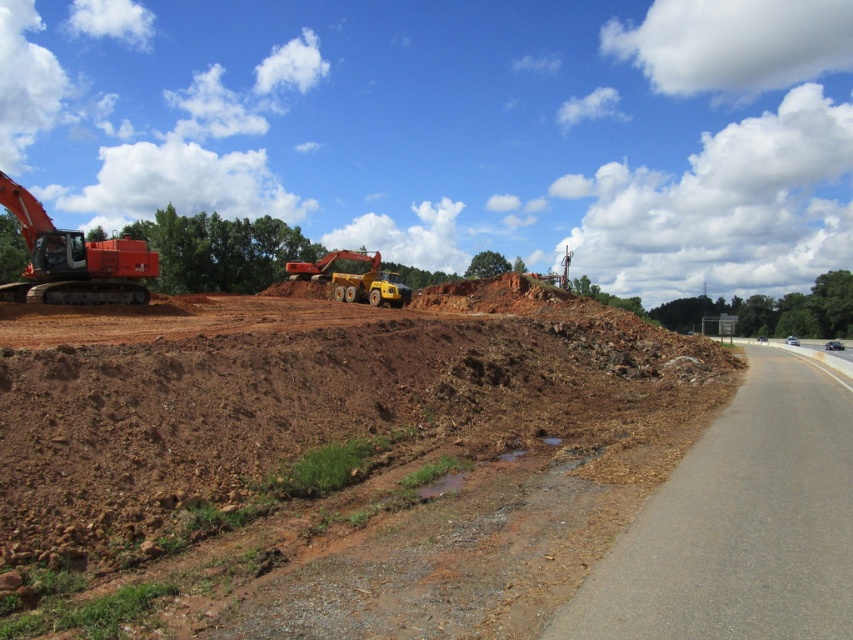
Question: Which is farther from the orange metallic excavator at left?

Choices:
 (A) yellow rubber dump truck at center
 (B) gray asphalt road at right
 (C) brown soil at lower left

Answer: (B)

Question: Which object is the farthest from the yellow rubber dump truck at center?

Choices:
 (A) orange metallic excavator at left
 (B) gray asphalt road at right
 (C) brown soil at lower left

Answer: (B)

Question: Which object is farther from the camera taking this photo?

Choices:
 (A) brown soil at lower left
 (B) yellow rubber dump truck at center

Answer: (B)

Question: Does gray asphalt road at right have a lesser width compared to orange metallic excavator at left?

Choices:
 (A) no
 (B) yes

Answer: (B)

Question: Can you confirm if orange metallic excavator at left is positioned to the right of yellow rubber dump truck at center?

Choices:
 (A) yes
 (B) no

Answer: (B)

Question: From the image, what is the correct spatial relationship of gray asphalt road at right in relation to orange metallic excavator at left?

Choices:
 (A) below
 (B) above

Answer: (A)